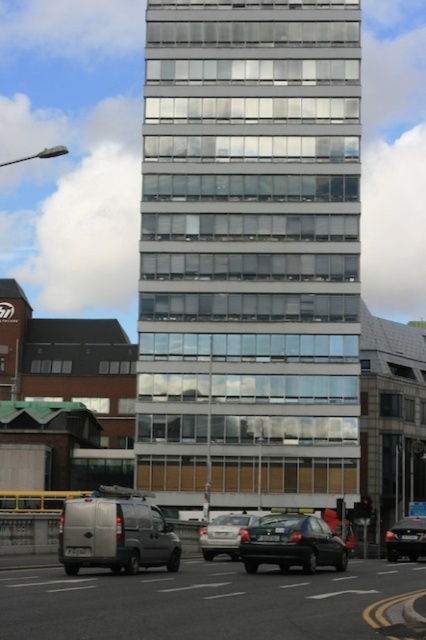
You are a pedestrian standing on the sidewalk in front of the clear glass building at center and the silver metallic sedan at center. Which object is positioned higher from the ground?

The clear glass building at center is located above the silver metallic sedan at center, so it is positioned higher from the ground.

Based on the photo, you are a delivery driver who needs to park your vehicle in a parking spot that can only accommodate vehicles narrower than the shiny black sedan at lower right. You are driving the silver metallic van at lower left. Can you safely park your van in this spot?

The silver metallic van at lower left is wider than the shiny black sedan at lower right. Since the parking spot can only accommodate vehicles narrower than the shiny black sedan, the van cannot fit safely in the spot.

You are a pedestrian standing at the crosswalk in front of the modern multi story building. You see the silver metallic van at lower left and the shiny black sedan at lower right. Which vehicle is closer to the left side of the road?

The silver metallic van at lower left is closer to the left side of the road since it is positioned to the left of the shiny black sedan at lower right.